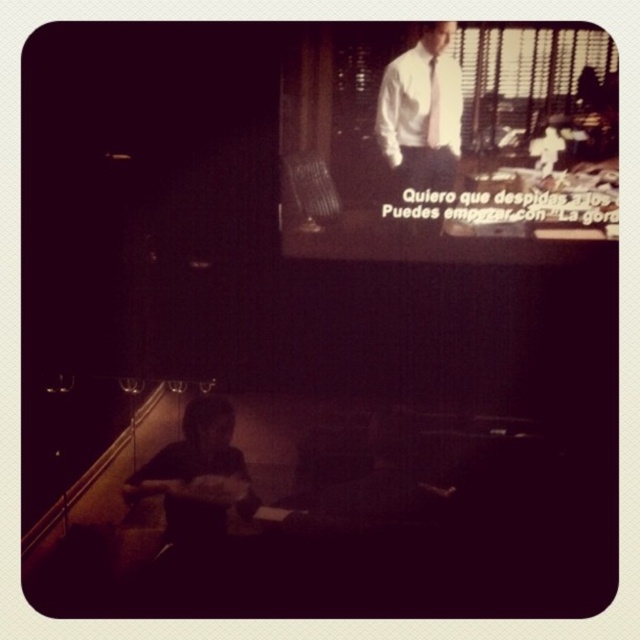
Does white shirt and tie at upper center have a lesser height compared to white silk tie at upper center?

No.

Is point (404, 92) positioned behind point (436, 92)?

Yes.

Locate an element on the screen. This screenshot has width=640, height=640. white shirt and tie at upper center is located at coordinates (420, 113).